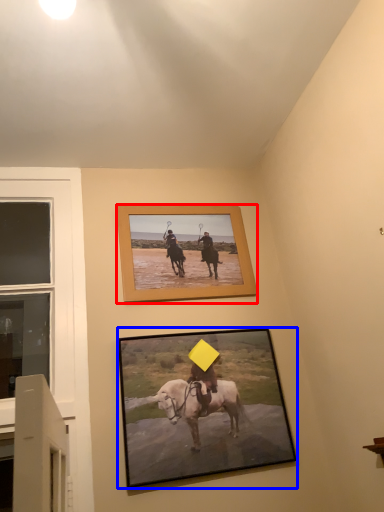
Question: Among these objects, which one is farthest to the camera, picture frame (highlighted by a red box) or picture frame (highlighted by a blue box)?

Choices:
 (A) picture frame
 (B) picture frame

Answer: (A)